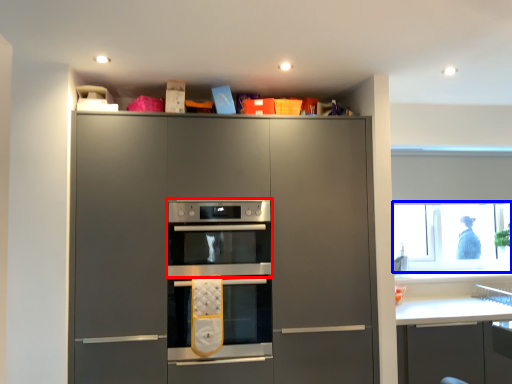
Question: Which of the following is the farthest to the observer, oven (highlighted by a red box) or window screen (highlighted by a blue box)?

Choices:
 (A) oven
 (B) window screen

Answer: (B)